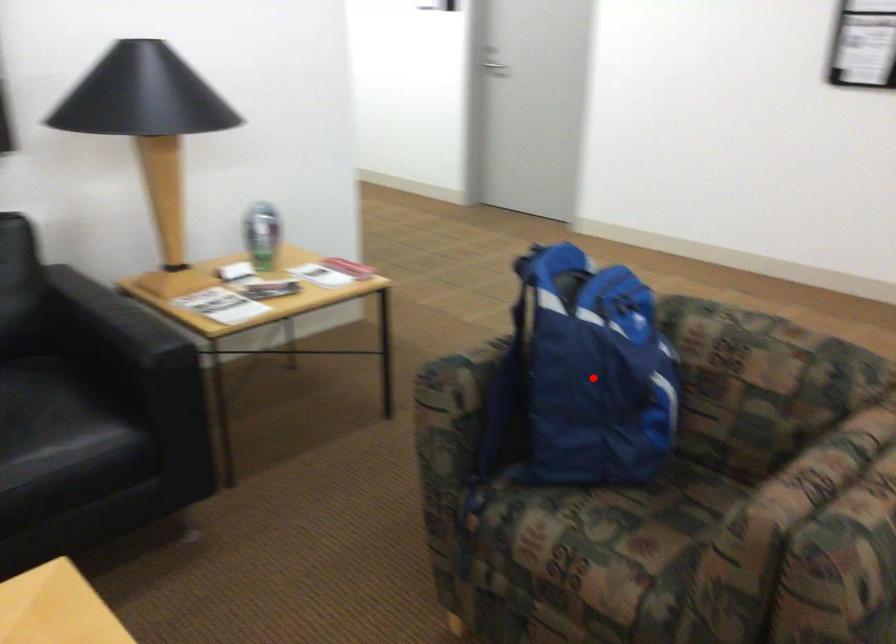
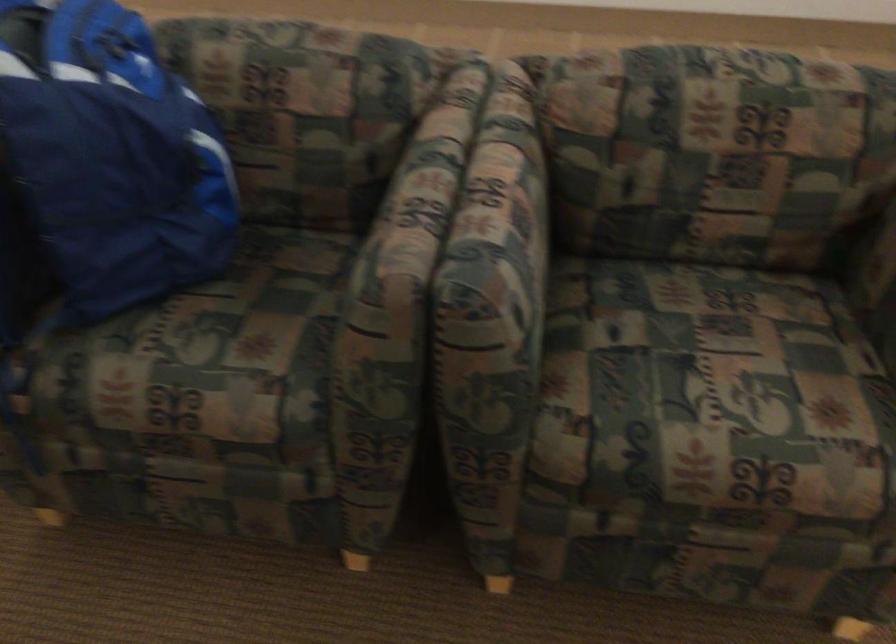
Question: I am providing you with two images of the same scene from different viewpoints. Image1 has a red point marked. In image2, the corresponding 3D location appears at what relative position? Reply with the corresponding letter.

Choices:
 (A) Closer
 (B) Farther

Answer: (A)